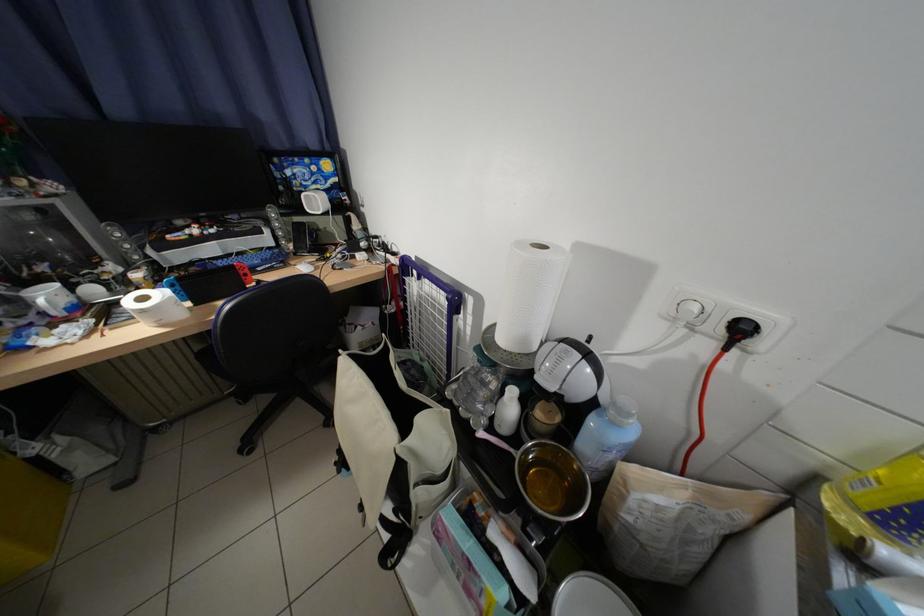
At what (x,y) coordinates should I click in order to perform the action: click on light blue bottle. Please return your answer as a coordinate pair (x, y). The height and width of the screenshot is (616, 924). Looking at the image, I should click on (606, 437).